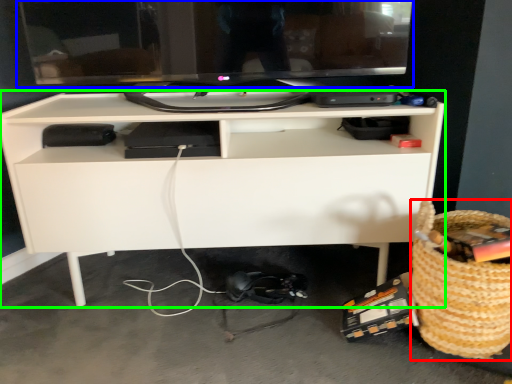
Question: Considering the real-world distances, which object is closest to basket (highlighted by a red box)? computer monitor (highlighted by a blue box) or desk (highlighted by a green box).

Choices:
 (A) computer monitor
 (B) desk

Answer: (B)